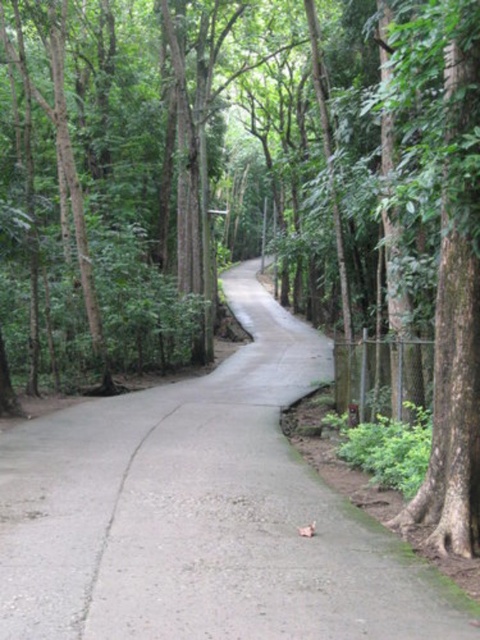
You are standing at the entrance of the forest and see the gray concrete pavement at center. Based on its position, can you determine if it leads towards the right side of the forest?

The gray concrete pavement at center curves gently to the right as it extends into the distance, so yes, it leads towards the right side of the forest.